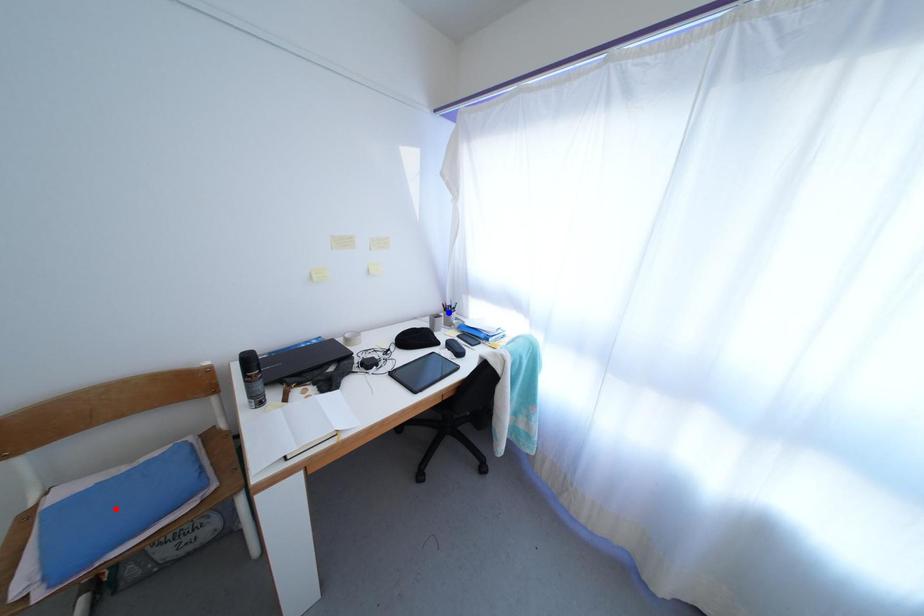
Question: Which of the two points in the image is closer to the camera?

Choices:
 (A) Blue point is closer.
 (B) Red point is closer.

Answer: (B)